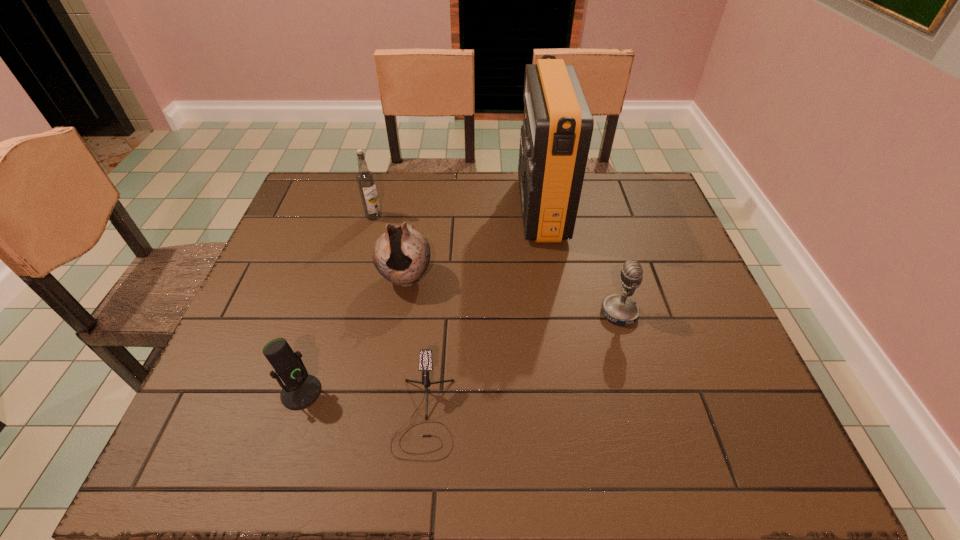
Where is `microphone identified as the closest to the farthest microphone`? The height and width of the screenshot is (540, 960). microphone identified as the closest to the farthest microphone is located at coordinates (425, 355).

Point out which microphone is positioned as the second nearest to the pottery. Please provide its 2D coordinates. Your answer should be formatted as a tuple, i.e. [(x, y)], where the tuple contains the x and y coordinates of a point satisfying the conditions above.

[(301, 389)]

Locate an element on the screen. The width and height of the screenshot is (960, 540). vacant space that satisfies the following two spatial constraints: 1. on the front-facing side of the radio receiver; 2. on the stand of the shortest microphone is located at coordinates (573, 416).

What are the coordinates of `vacant point that satisfies the following two spatial constraints: 1. on the front-facing side of the tallest object; 2. from the spout of the fourth nearest object` in the screenshot? It's located at (552, 278).

Where is `vacant point that satisfies the following two spatial constraints: 1. on the front-facing side of the radio receiver; 2. on the label of the vodka`? The image size is (960, 540). vacant point that satisfies the following two spatial constraints: 1. on the front-facing side of the radio receiver; 2. on the label of the vodka is located at coordinates (542, 216).

This screenshot has height=540, width=960. In order to click on vacant area in the image that satisfies the following two spatial constraints: 1. on the front-facing side of the rightmost object; 2. on the stand of the second microphone from left to right in this screenshot , I will do pyautogui.click(x=648, y=416).

Locate an element on the screen. This screenshot has height=540, width=960. free space in the image that satisfies the following two spatial constraints: 1. on the front-facing side of the rightmost object; 2. on the stand of the shortest object is located at coordinates (648, 416).

Locate an element on the screen. Image resolution: width=960 pixels, height=540 pixels. free space that satisfies the following two spatial constraints: 1. on the front-facing side of the radio receiver; 2. from the spout of the third farthest object is located at coordinates (552, 278).